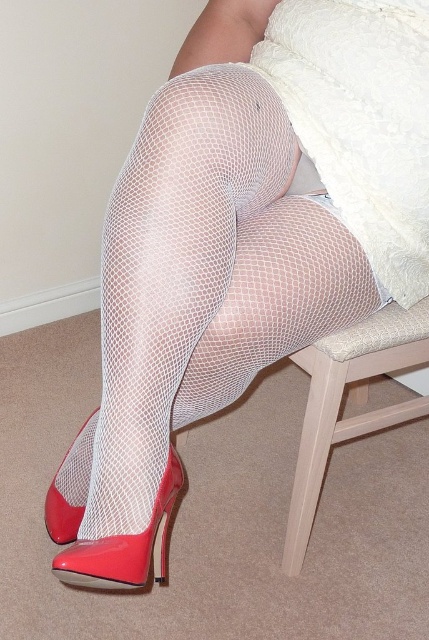
Question: Is white lace pillow at upper center behind shiny patent leather high-heeled shoe at lower left?

Choices:
 (A) no
 (B) yes

Answer: (B)

Question: Which point is farther from the camera taking this photo?

Choices:
 (A) (59, 493)
 (B) (109, 577)
 (C) (307, 432)
 (D) (414, 204)

Answer: (C)

Question: Which object is the closest to the matte red high-heeled shoe at lower left?

Choices:
 (A) white lace pillow at upper center
 (B) light wood stool at lower center

Answer: (B)

Question: Estimate the real-world distances between objects in this image. Which object is closer to the shiny patent leather high-heeled shoe at lower left?

Choices:
 (A) light wood stool at lower center
 (B) white lace pillow at upper center
 (C) matte red high-heeled shoe at lower left

Answer: (C)

Question: Does white lace pillow at upper center appear under light wood stool at lower center?

Choices:
 (A) yes
 (B) no

Answer: (B)

Question: Does light wood stool at lower center appear over matte red high-heeled shoe at lower left?

Choices:
 (A) yes
 (B) no

Answer: (A)